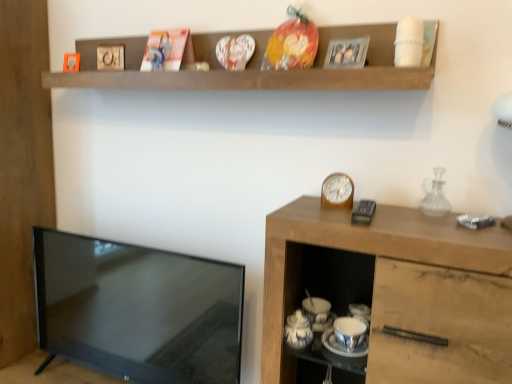
Image resolution: width=512 pixels, height=384 pixels. I want to click on free space in front of wooden clock at right, so click(x=342, y=222).